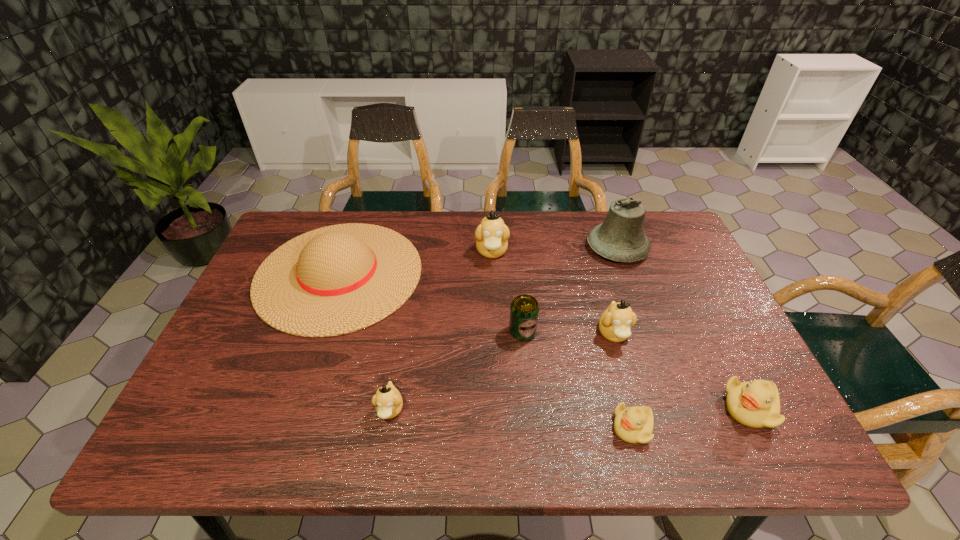
At what (x,y) coordinates should I click in order to perform the action: click on object that is at the far left corner. Please return your answer as a coordinate pair (x, y). This screenshot has width=960, height=540. Looking at the image, I should click on (338, 279).

This screenshot has width=960, height=540. Find the location of `object located at the far right corner`. object located at the far right corner is located at coordinates (620, 238).

Locate an element on the screen. The width and height of the screenshot is (960, 540). object located in the near right corner section of the desktop is located at coordinates (756, 404).

This screenshot has width=960, height=540. What are the coordinates of `vacant space at the far edge of the desktop` in the screenshot? It's located at (339, 220).

Identify the location of vacant area at the near edge of the desktop. The width and height of the screenshot is (960, 540). (422, 418).

The width and height of the screenshot is (960, 540). In the image, there is a desktop. What are the coordinates of `blank space at the right edge` in the screenshot? It's located at (700, 269).

In the image, there is a desktop. At what (x,y) coordinates should I click in order to perform the action: click on free region at the far left corner. Please return your answer as a coordinate pair (x, y). Looking at the image, I should click on (321, 215).

Where is `free space at the near left corner`? The image size is (960, 540). free space at the near left corner is located at coordinates (227, 450).

At what (x,y) coordinates should I click in order to perform the action: click on vacant space at the far right corner of the desktop. Please return your answer as a coordinate pair (x, y). Image resolution: width=960 pixels, height=540 pixels. Looking at the image, I should click on (657, 223).

Find the location of a particular element. vacant space that's between the second tallest duckling and the shortest duckling is located at coordinates (623, 381).